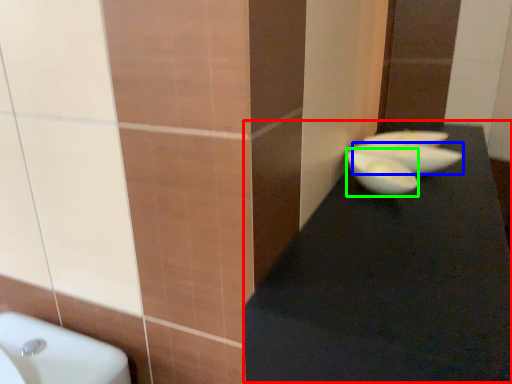
Question: Estimate the real-world distances between objects in this image. Which object is farther from table top (highlighted by a red box), basin (highlighted by a blue box) or glass bowl (highlighted by a green box)?

Choices:
 (A) basin
 (B) glass bowl

Answer: (A)